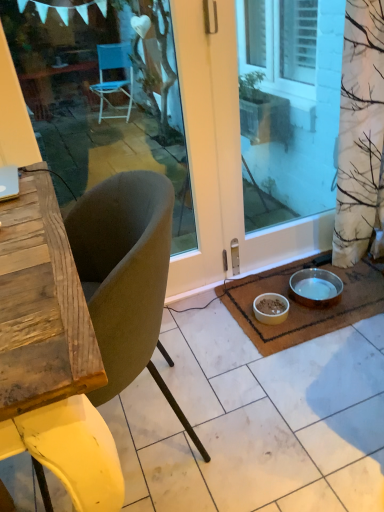
Locate an element on the screen. The height and width of the screenshot is (512, 384). free space in front of white matte bowl at lower center, the first bowl viewed from the left is located at coordinates (278, 339).